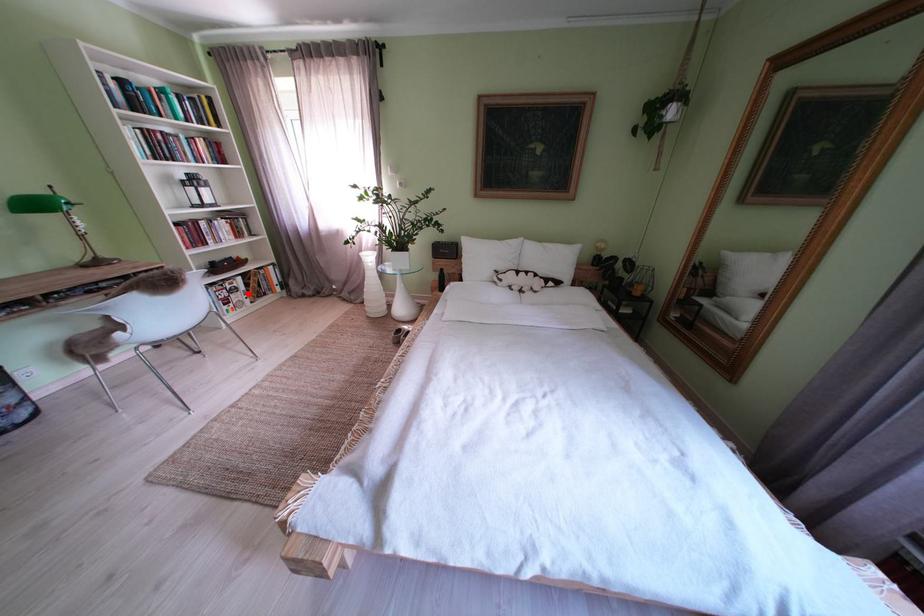
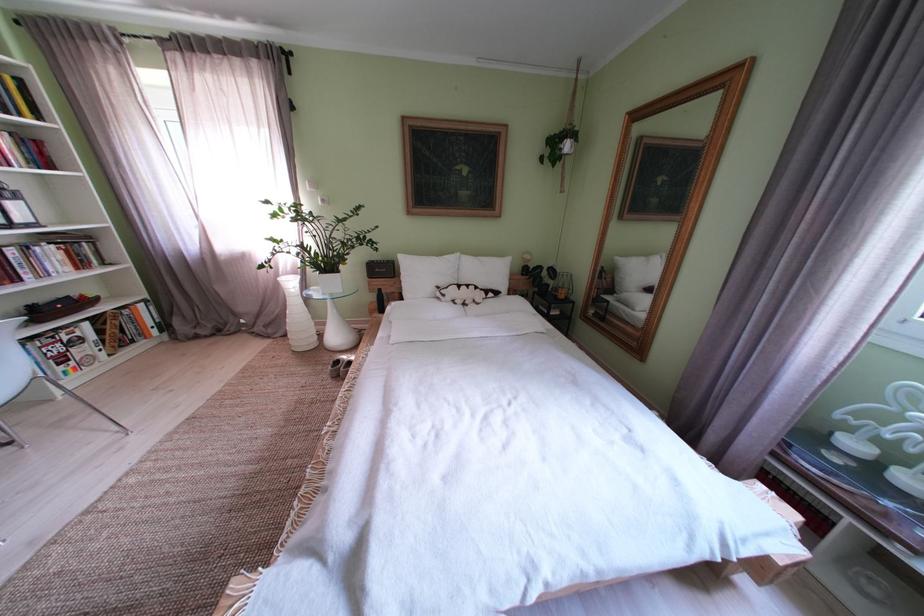
Find the pixel in the second image that matches the highlighted location in the first image.

(92, 344)